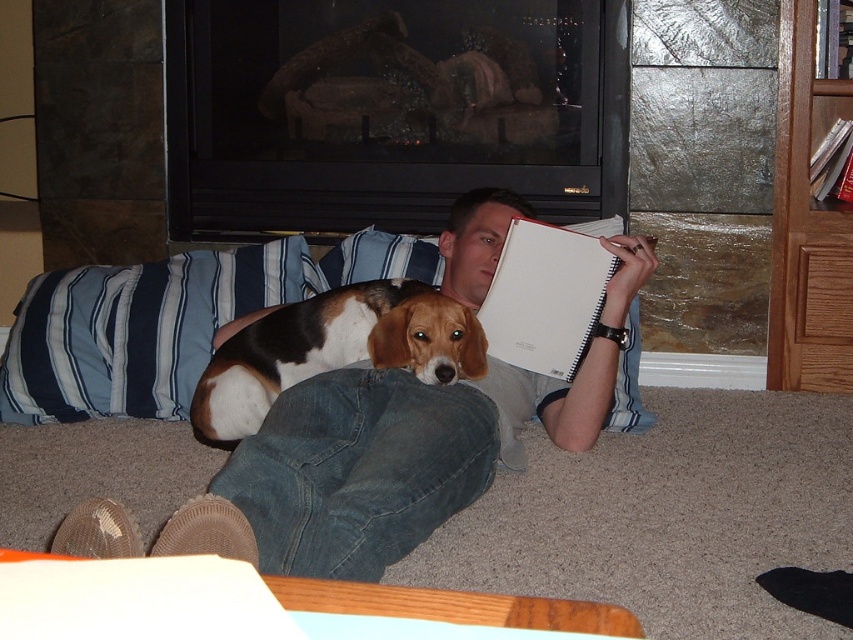
Question: Which of these objects is positioned farthest from the tri-colored fur beagle at center?

Choices:
 (A) white matte notebook at center
 (B) denim jeans at center

Answer: (A)

Question: Estimate the real-world distances between objects in this image. Which object is farther from the denim jeans at center?

Choices:
 (A) blue striped pillow at left
 (B) white matte notebook at center
 (C) tri-colored fur beagle at center

Answer: (A)

Question: Is blue striped pillow at left thinner than tri-colored fur beagle at center?

Choices:
 (A) no
 (B) yes

Answer: (A)

Question: Is denim jeans at center below tri-colored fur beagle at center?

Choices:
 (A) yes
 (B) no

Answer: (A)

Question: Does blue striped pillow at left have a greater width compared to tri-colored fur beagle at center?

Choices:
 (A) no
 (B) yes

Answer: (B)

Question: Which object is positioned closest to the blue striped pillow at left?

Choices:
 (A) tri-colored fur beagle at center
 (B) white matte notebook at center

Answer: (A)